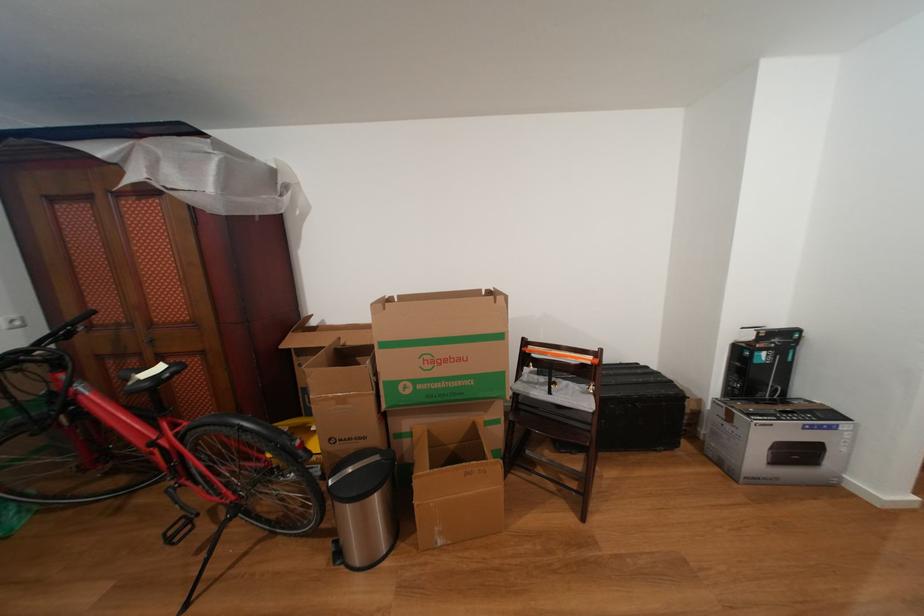
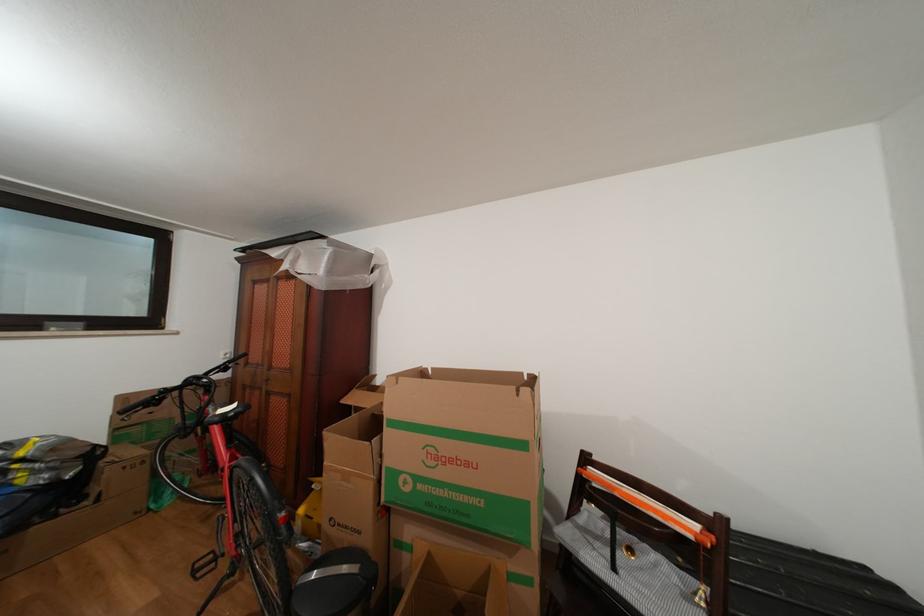
Locate, in the second image, the point that corresponds to [178,538] in the first image.

(205, 570)